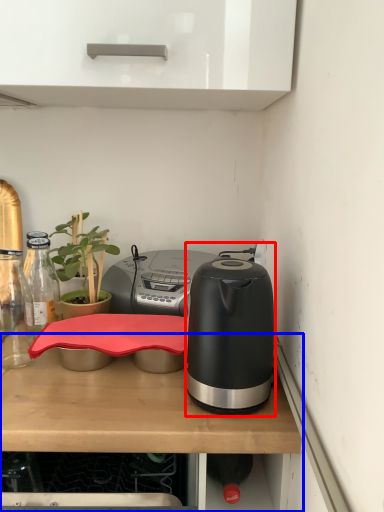
Question: Which of the following is the closest to the observer, kitchen appliance (highlighted by a red box) or desk (highlighted by a blue box)?

Choices:
 (A) kitchen appliance
 (B) desk

Answer: (B)